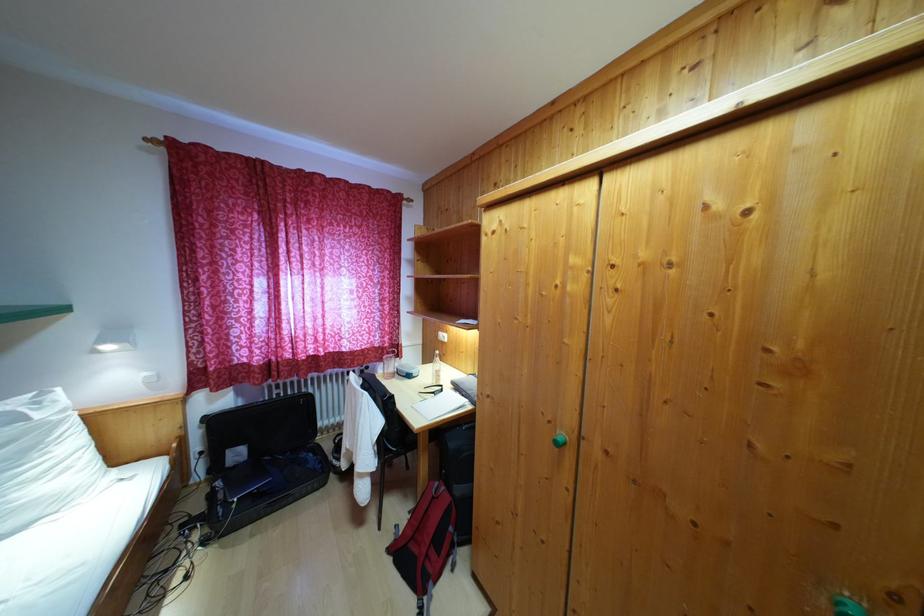
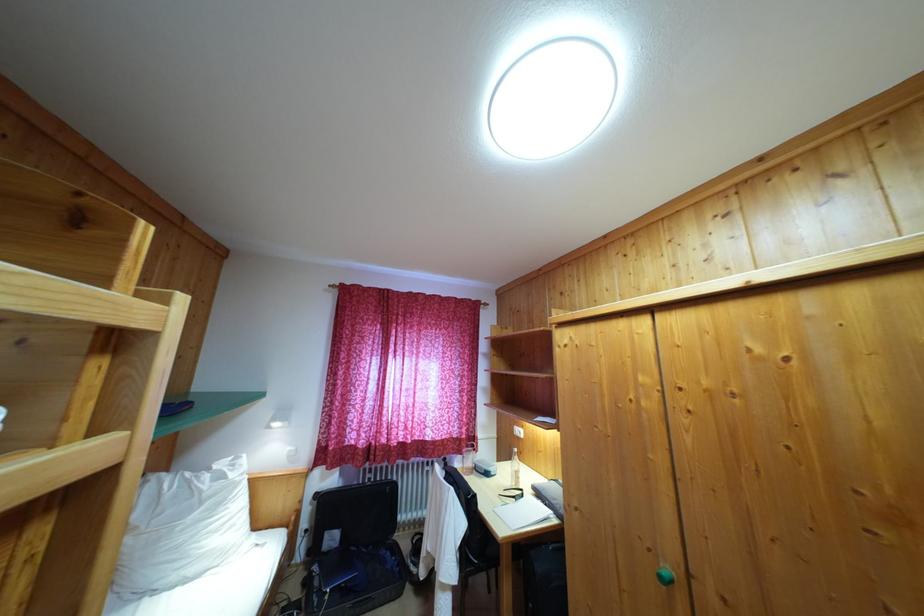
In the second image, find the point that corresponds to point 445,397 in the first image.

(526, 501)